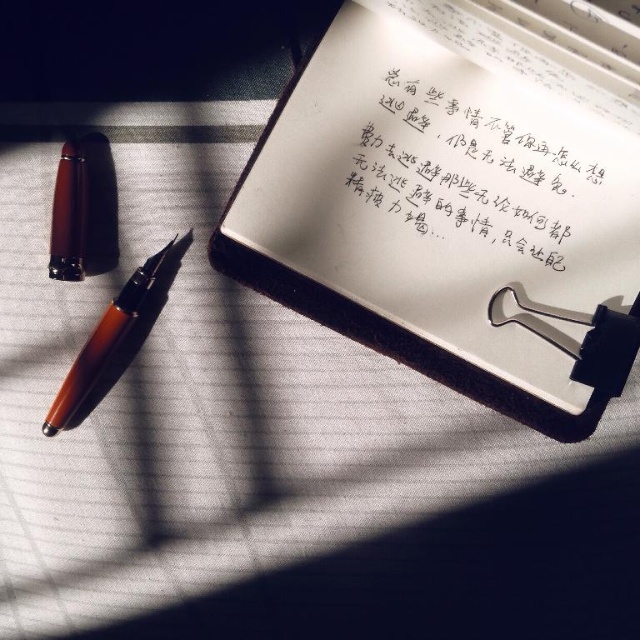
You need to mail a postcard that requires a stamp. You have a stamp that exactly fits the size of the brown polished wood pencil at left. Will the stamp be large enough to cover the white paper notebook at upper center?

The white paper notebook at upper center is bigger than the brown polished wood pencil at left. Since the stamp is the same size as the pencil, it will not be large enough to cover the notebook.

Consider the image. You are an artist who needs to reach for the brown polished wood pencil at left while holding the white paper notebook at upper center. Can you comfortably reach the pencil without moving the notebook?

The white paper notebook at upper center is 55.09 centimeters away from the brown polished wood pencil at left. Since this distance is quite large, you would need to move the notebook or adjust your position to comfortably reach the pencil.